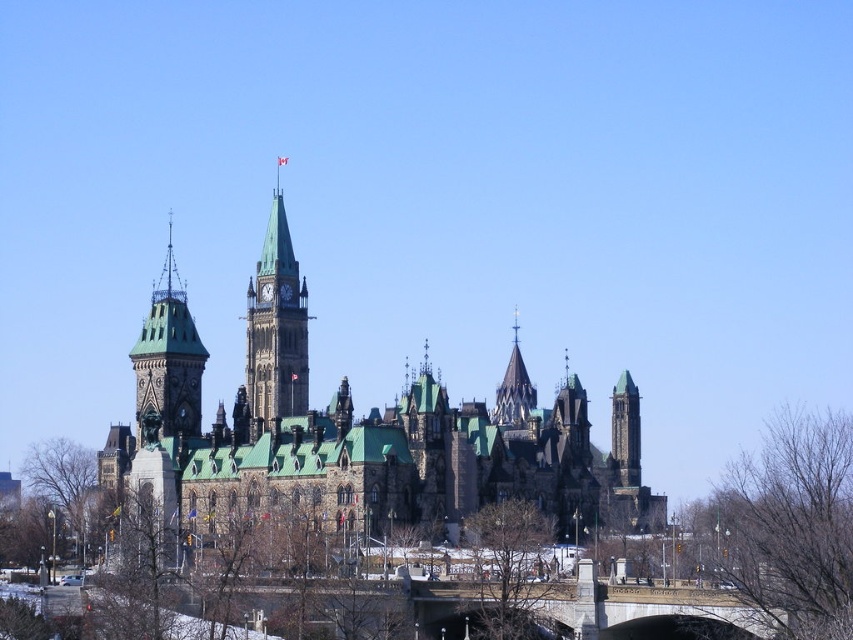
Which is more to the left, dark gray stone castle at center or polished stone spire at center?

From the viewer's perspective, dark gray stone castle at center appears more on the left side.

Is dark gray stone castle at center thinner than polished stone spire at center?

In fact, dark gray stone castle at center might be wider than polished stone spire at center.

Where is `dark gray stone castle at center`? Image resolution: width=853 pixels, height=640 pixels. dark gray stone castle at center is located at coordinates (340, 433).

Locate an element on the screen. The image size is (853, 640). dark gray stone castle at center is located at coordinates (340, 433).

Can you confirm if dark brown stone clock tower at left is positioned to the right of dark gray stone tower at center right?

No, dark brown stone clock tower at left is not to the right of dark gray stone tower at center right.

Which is more to the left, dark brown stone clock tower at left or dark gray stone tower at center right?

dark brown stone clock tower at left

Is point (178, 316) positioned in front of point (625, 452)?

Yes, it is in front of point (625, 452).

You are a GUI agent. You are given a task and a screenshot of the screen. Output one action in this format:
    pyautogui.click(x=<x>, y=<y>)
    Task: Click on the dark brown stone clock tower at left
    The height and width of the screenshot is (640, 853).
    Given the screenshot: What is the action you would take?
    pyautogui.click(x=167, y=362)

Does green stone clock tower at center have a smaller size compared to polished stone spire at center?

No.

Does green stone clock tower at center have a lesser height compared to polished stone spire at center?

No, green stone clock tower at center is not shorter than polished stone spire at center.

Where is `green stone clock tower at center`? green stone clock tower at center is located at coordinates (276, 324).